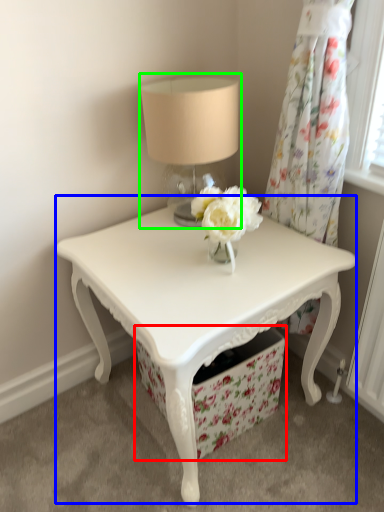
Question: Estimate the real-world distances between objects in this image. Which object is closer to drawer (highlighted by a red box), table (highlighted by a blue box) or table lamp (highlighted by a green box)?

Choices:
 (A) table
 (B) table lamp

Answer: (A)